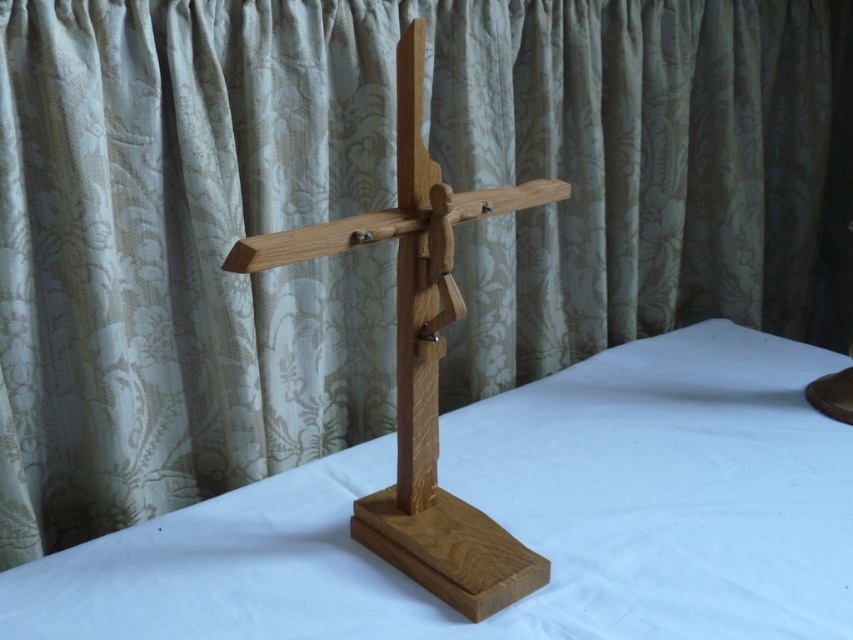
Question: Which point is closer to the camera?

Choices:
 (A) natural wood table at center
 (B) natural wood crucifix at center

Answer: (B)

Question: Does natural wood table at center have a lesser width compared to natural wood crucifix at center?

Choices:
 (A) yes
 (B) no

Answer: (B)

Question: Does natural wood table at center have a greater width compared to natural wood crucifix at center?

Choices:
 (A) no
 (B) yes

Answer: (B)

Question: Is natural wood table at center below natural wood crucifix at center?

Choices:
 (A) yes
 (B) no

Answer: (A)